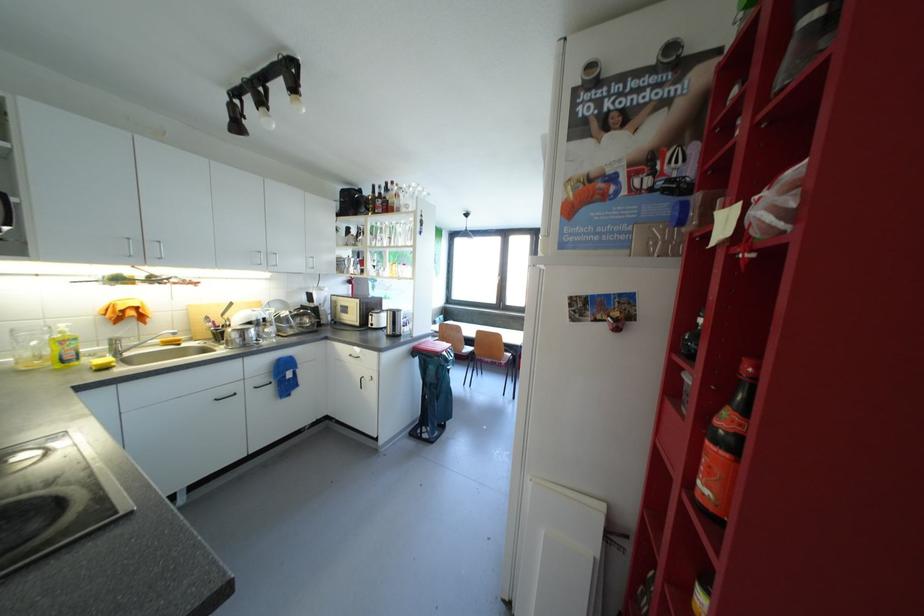
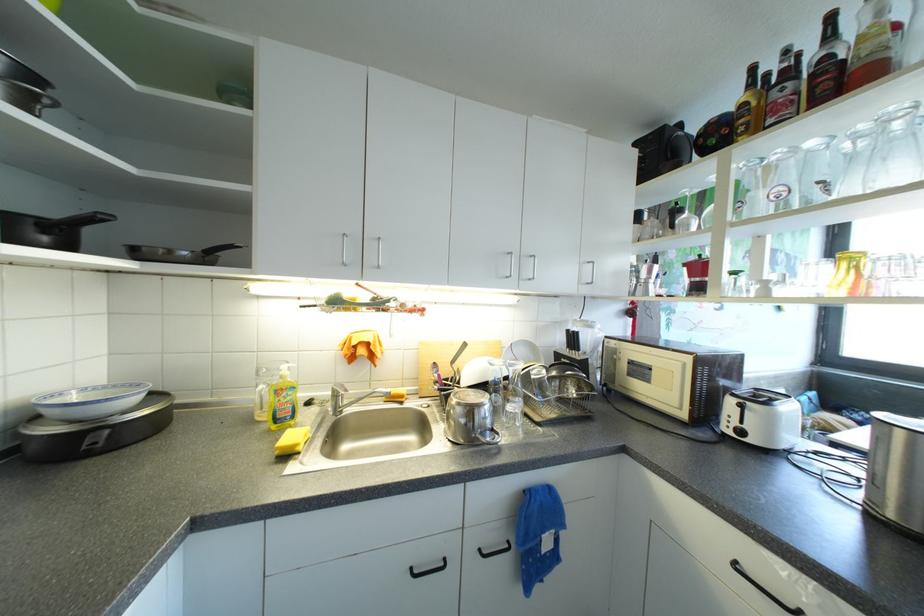
In the second image, find the point that corresponds to point 68,331 in the first image.

(290, 373)